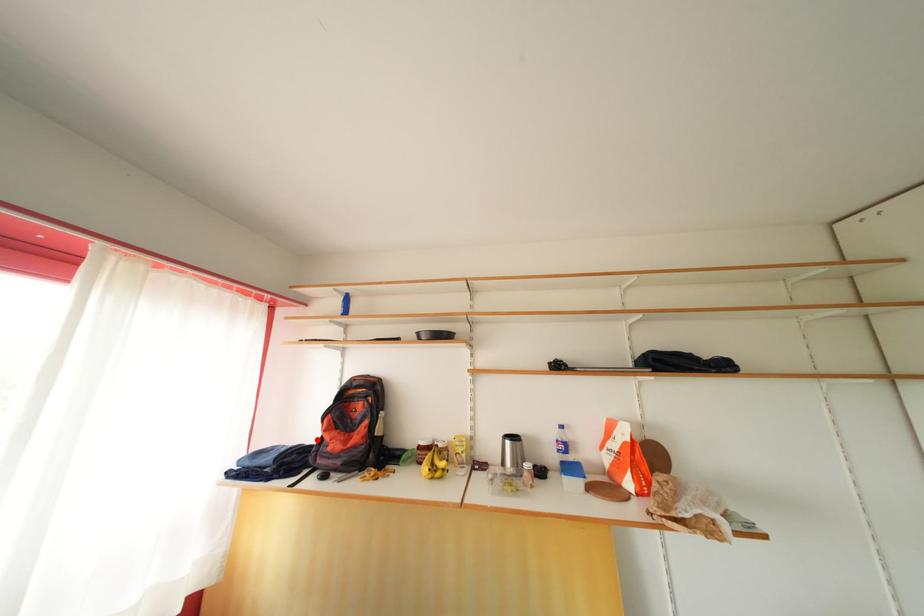
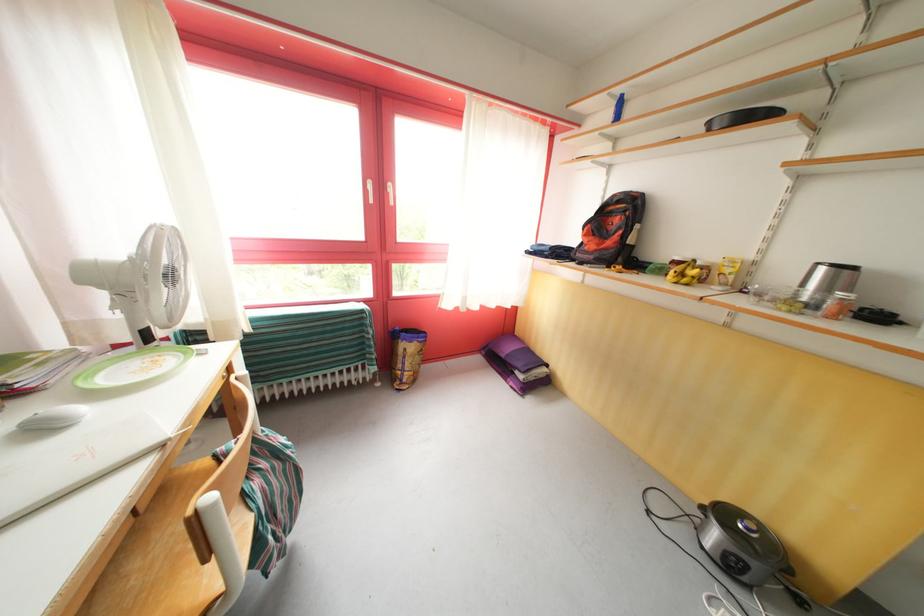
Question: I am providing you with two images of the same scene from different viewpoints. In image1, a red point is highlighted. Considering the same 3D point in image2, which of the following is correct?

Choices:
 (A) It is closer
 (B) It is farther

Answer: (A)